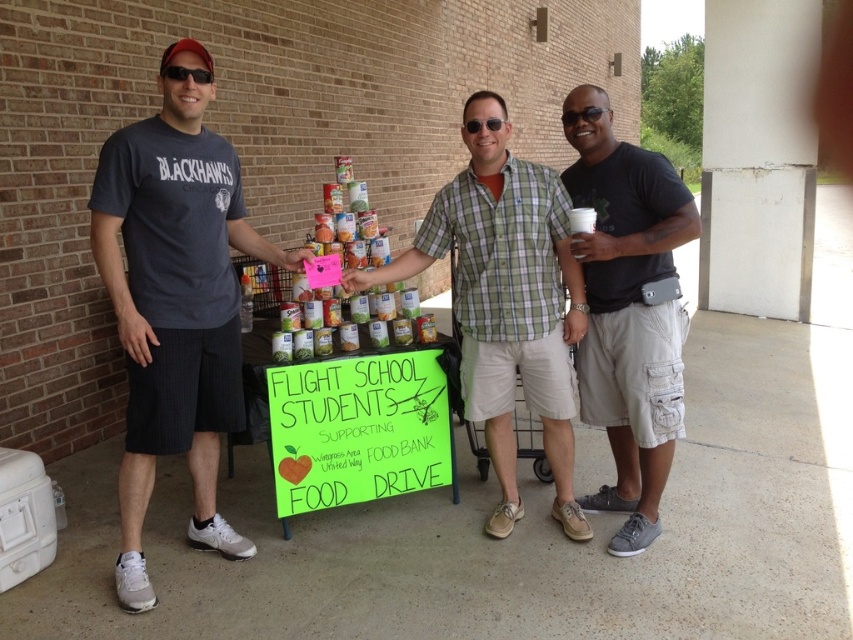
Question: Among these objects, which one is farthest from the camera?

Choices:
 (A) dark gray t-shirt at left
 (B) green plaid shirt at center

Answer: (B)

Question: Does dark gray t-shirt at left have a larger size compared to black cotton t-shirt at center?

Choices:
 (A) no
 (B) yes

Answer: (B)

Question: Considering the real-world distances, which object is farthest from the dark gray t-shirt at left?

Choices:
 (A) black cotton t-shirt at center
 (B) green plaid shirt at center

Answer: (A)

Question: Can you confirm if dark gray t-shirt at left is thinner than black cotton t-shirt at center?

Choices:
 (A) yes
 (B) no

Answer: (B)

Question: Does green plaid shirt at center have a larger size compared to black cotton t-shirt at center?

Choices:
 (A) no
 (B) yes

Answer: (B)

Question: Among these objects, which one is nearest to the camera?

Choices:
 (A) black cotton t-shirt at center
 (B) green plaid shirt at center
 (C) dark gray t-shirt at left

Answer: (C)